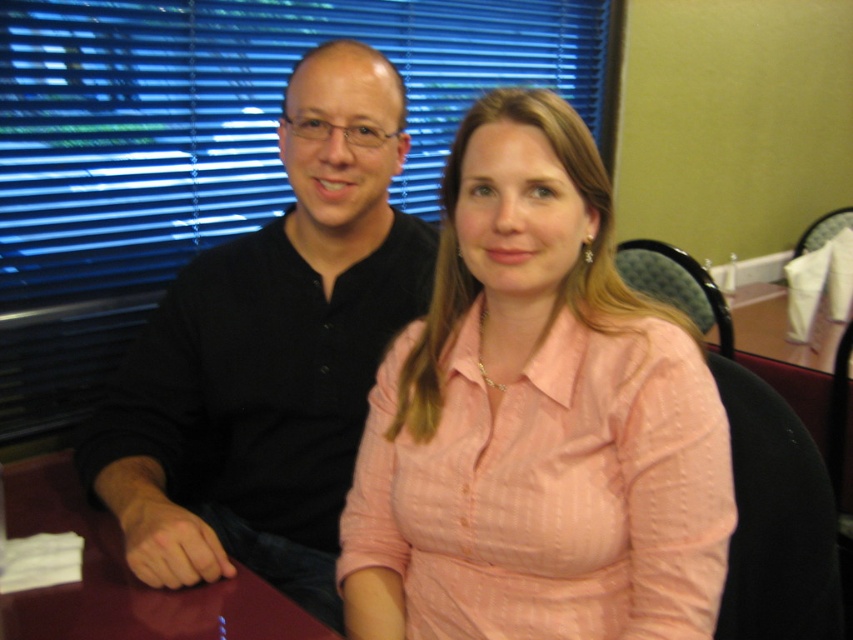
Question: Which object is positioned closest to the blue matte blinds at upper center?

Choices:
 (A) black matte shirt at left
 (B) maroon glossy table at lower left

Answer: (A)

Question: Which of the following is the farthest from the observer?

Choices:
 (A) pink textured shirt at center
 (B) blue matte blinds at upper center
 (C) maroon glossy table at lower left
 (D) black matte shirt at left

Answer: (B)

Question: Can you confirm if pink textured shirt at center is positioned to the left of black matte shirt at left?

Choices:
 (A) yes
 (B) no

Answer: (B)

Question: Does black matte shirt at left have a lesser width compared to maroon glossy table at lower left?

Choices:
 (A) yes
 (B) no

Answer: (A)

Question: Which of the following is the farthest from the observer?

Choices:
 (A) black matte shirt at left
 (B) maroon glossy table at lower left

Answer: (A)

Question: Can you confirm if pink textured shirt at center is thinner than black matte shirt at left?

Choices:
 (A) no
 (B) yes

Answer: (B)